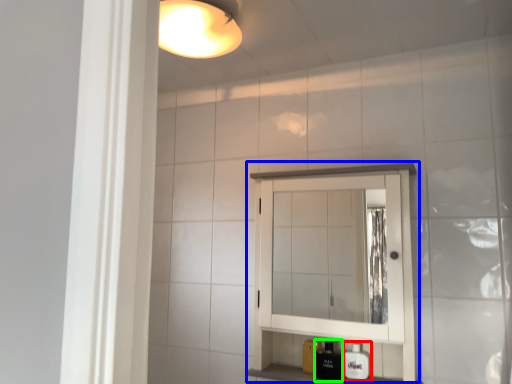
Question: Considering the real-world distances, which object is closest to soap dispenser (highlighted by a red box)? medicine cabinet (highlighted by a blue box) or toiletry (highlighted by a green box).

Choices:
 (A) medicine cabinet
 (B) toiletry

Answer: (B)